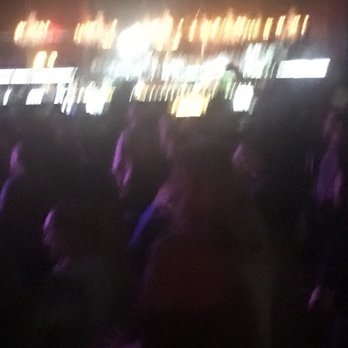
The width and height of the screenshot is (348, 348). I want to click on orange light, so click(174, 24).